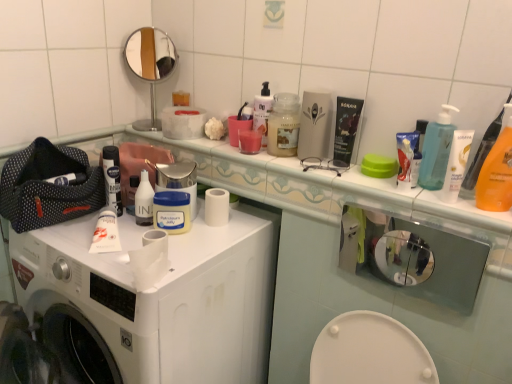
Find the location of `vacant space to the right of white plastic bottle at center, the 1th toiletry when ordered from left to right`. vacant space to the right of white plastic bottle at center, the 1th toiletry when ordered from left to right is located at coordinates (201, 230).